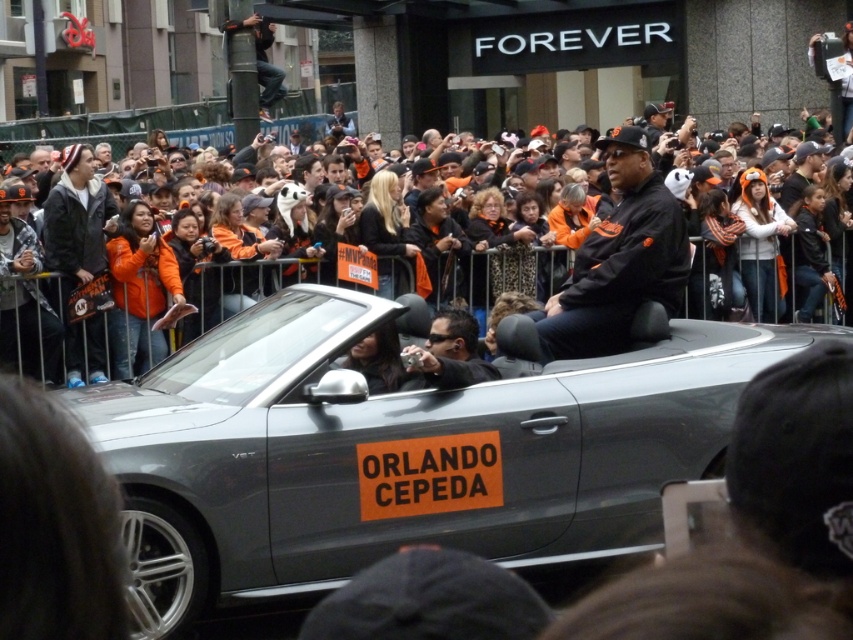
Is orange jersey fans at center thinner than matte black camera at center?

In fact, orange jersey fans at center might be wider than matte black camera at center.

This screenshot has width=853, height=640. Find the location of `orange jersey fans at center`. orange jersey fans at center is located at coordinates (485, 275).

Locate an element on the screen. This screenshot has height=640, width=853. orange jersey fans at center is located at coordinates (485, 275).

Based on the photo, is orange jersey fans at center to the right of black matte jacket at center from the viewer's perspective?

No, orange jersey fans at center is not to the right of black matte jacket at center.

Which is above, orange jersey fans at center or black matte jacket at center?

orange jersey fans at center is above.

Identify the location of orange jersey fans at center. The image size is (853, 640). (485, 275).

The height and width of the screenshot is (640, 853). I want to click on orange jersey fans at center, so click(x=485, y=275).

Does black matte jacket at center have a lesser width compared to matte black camera at center?

No, black matte jacket at center is not thinner than matte black camera at center.

Does black matte jacket at center appear over matte black camera at center?

Yes, black matte jacket at center is above matte black camera at center.

This screenshot has height=640, width=853. Describe the element at coordinates (618, 259) in the screenshot. I see `black matte jacket at center` at that location.

Locate an element on the screen. black matte jacket at center is located at coordinates (618, 259).